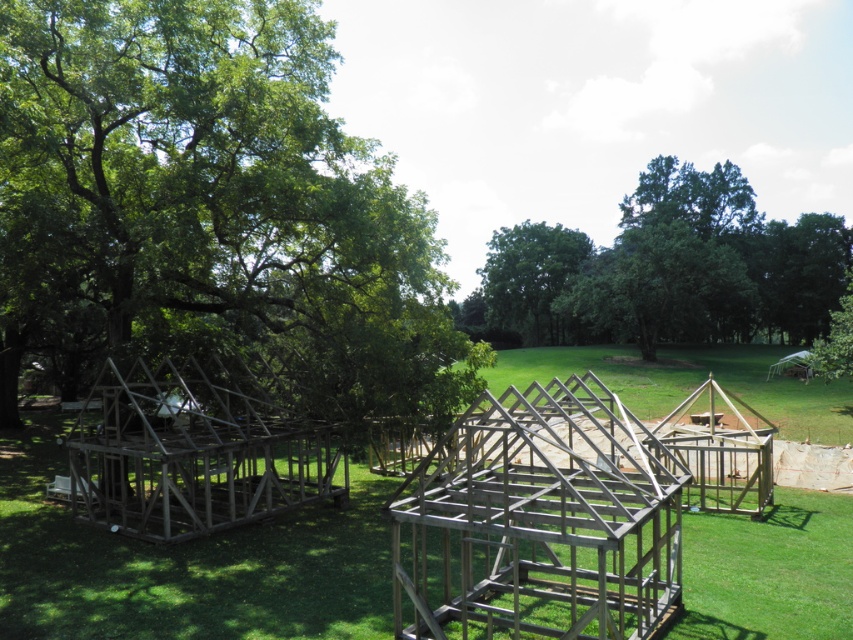
Can you confirm if green grass at center is positioned below green leafy tree at center?

Indeed, green grass at center is positioned under green leafy tree at center.

Does green grass at center come behind green leafy tree at center?

That is False.

The height and width of the screenshot is (640, 853). What are the coordinates of `green grass at center` in the screenshot? It's located at (184, 563).

Is green leafy tree at upper center closer to the viewer compared to green leafy tree at upper right?

That is True.

Can you confirm if green leafy tree at upper center is smaller than green leafy tree at upper right?

Actually, green leafy tree at upper center might be larger than green leafy tree at upper right.

The height and width of the screenshot is (640, 853). What are the coordinates of `green leafy tree at upper center` in the screenshot? It's located at (665, 269).

How far apart are green grass at center and green leafy tree at upper center?

green grass at center and green leafy tree at upper center are 33.03 meters apart from each other.

Does point (372, 577) come behind point (695, 186)?

No, it is in front of (695, 186).

Who is more distant from viewer, (x=47, y=531) or (x=704, y=332)?

Point (x=704, y=332)

Where is `green grass at center`? The image size is (853, 640). green grass at center is located at coordinates (184, 563).